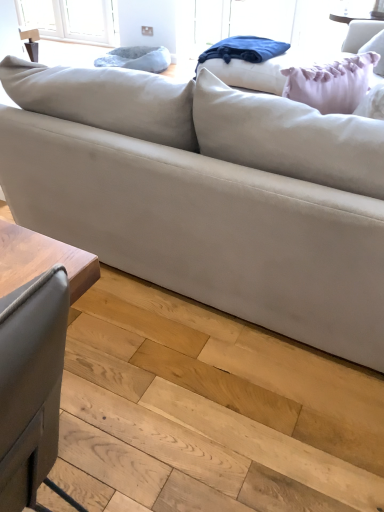
The height and width of the screenshot is (512, 384). What do you see at coordinates (208, 200) in the screenshot?
I see `suede couch at lower right` at bounding box center [208, 200].

Measure the distance between point (318, 265) and camera.

1.27 meters.

Locate an element on the screen. suede couch at lower right is located at coordinates (208, 200).

Identify the location of suede couch at lower right. (208, 200).